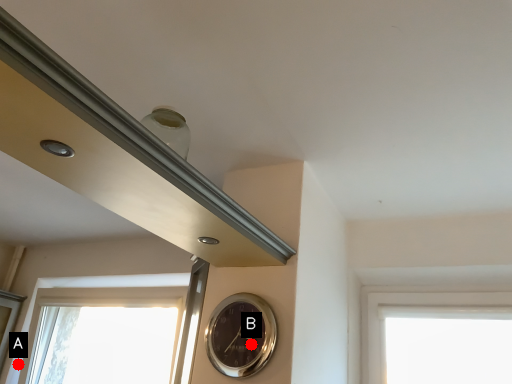
Question: Two points are circled on the image, labeled by A and B beside each circle. Which point appears closest to the camera in this image?

Choices:
 (A) A is closer
 (B) B is closer

Answer: (B)